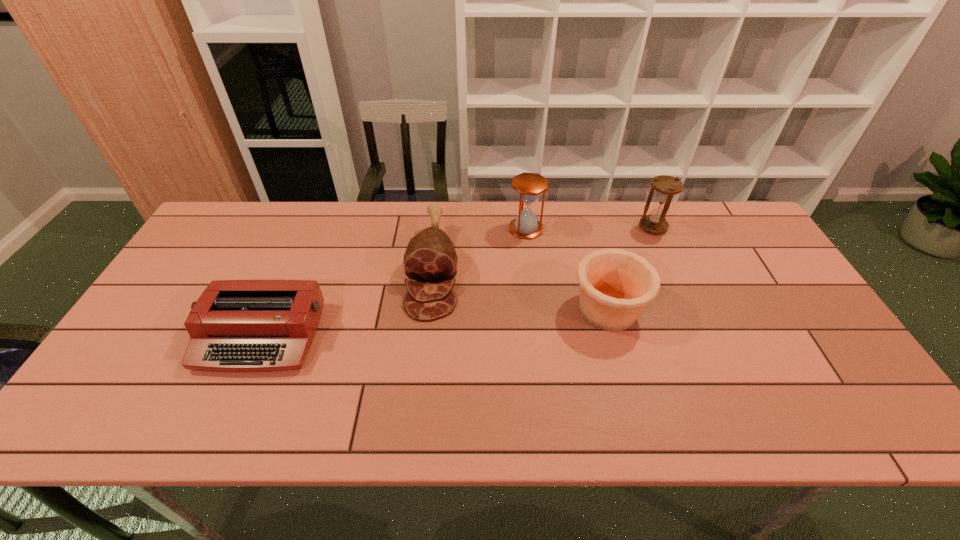
The height and width of the screenshot is (540, 960). Find the location of `free location that satisfies the following two spatial constraints: 1. on the back side of the third object from right to left; 2. on the right side of the right hourglass`. free location that satisfies the following two spatial constraints: 1. on the back side of the third object from right to left; 2. on the right side of the right hourglass is located at coordinates (526, 227).

This screenshot has width=960, height=540. I want to click on vacant space that satisfies the following two spatial constraints: 1. on the back side of the right hourglass; 2. on the left side of the pottery, so click(x=586, y=227).